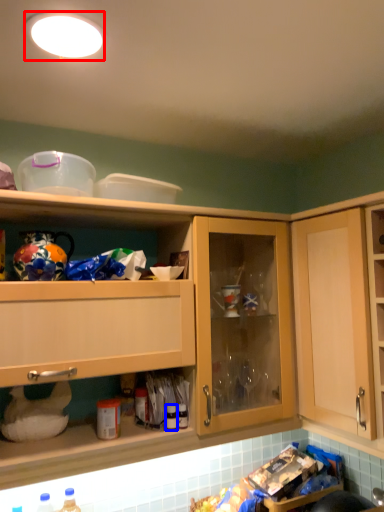
Question: Which of the following is the closest to the observer, lighting (highlighted by a red box) or bottle (highlighted by a blue box)?

Choices:
 (A) lighting
 (B) bottle

Answer: (A)